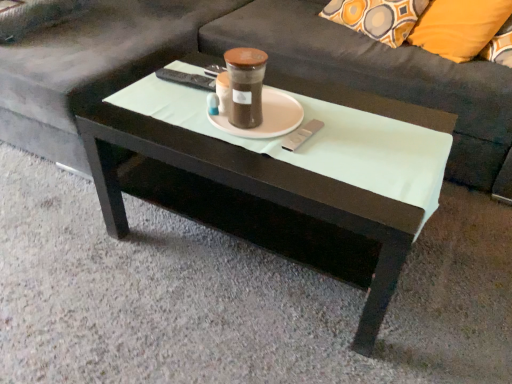
This screenshot has height=384, width=512. Identify the location of free spot in front of brown matte glass jar at center. (254, 154).